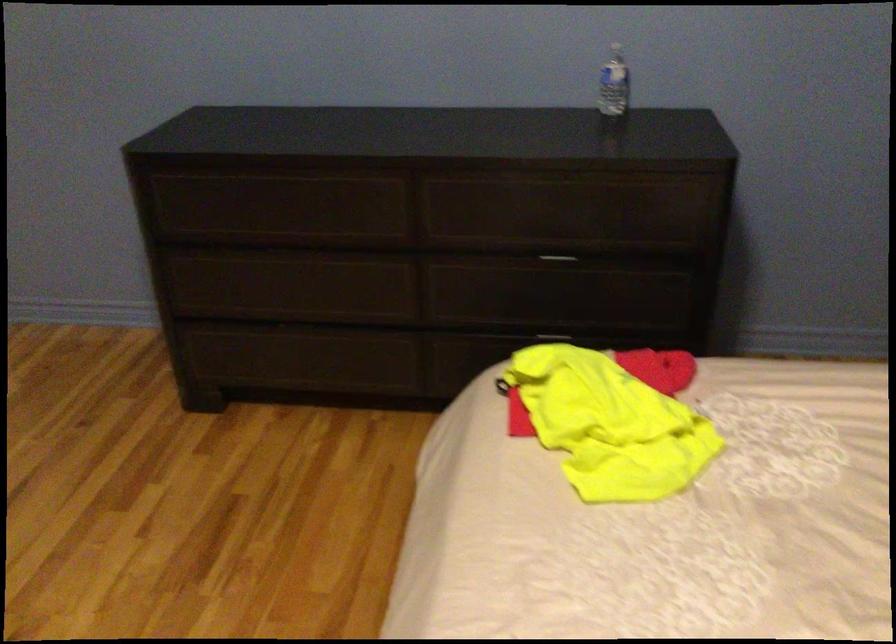
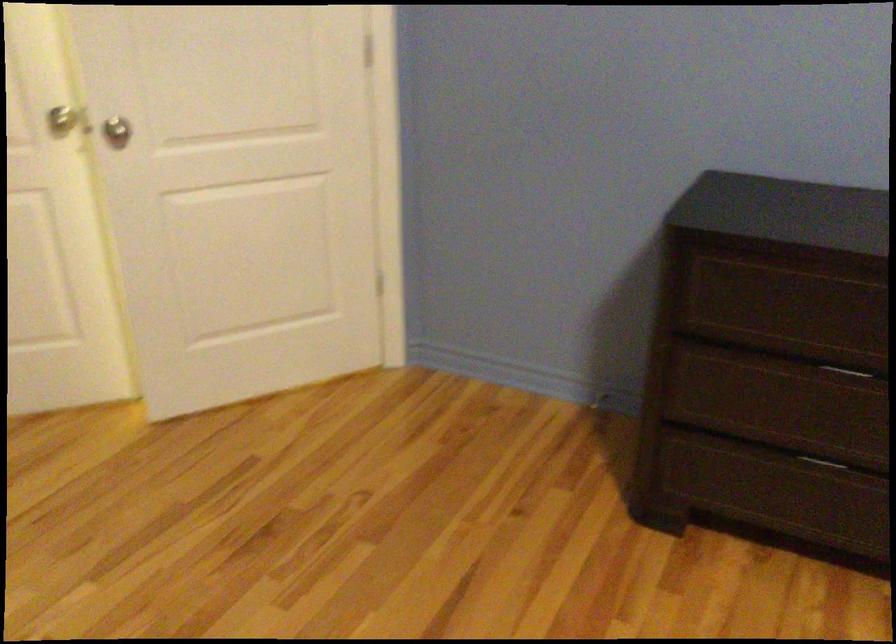
Question: The camera is either moving clockwise (left) or counter-clockwise (right) around the object. The first image is from the beginning of the video and the second image is from the end. Is the camera moving left or right when shooting the video?

Choices:
 (A) Left
 (B) Right

Answer: (B)